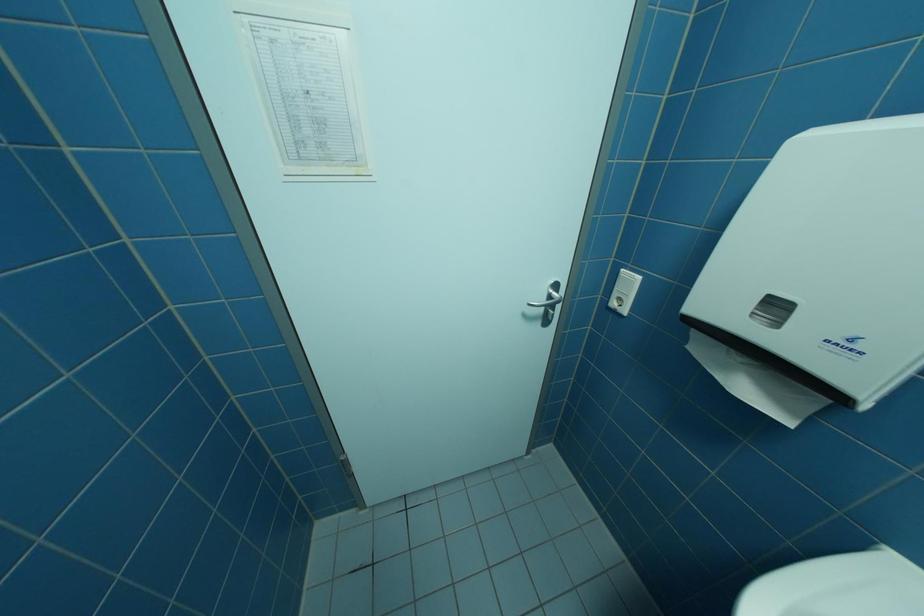
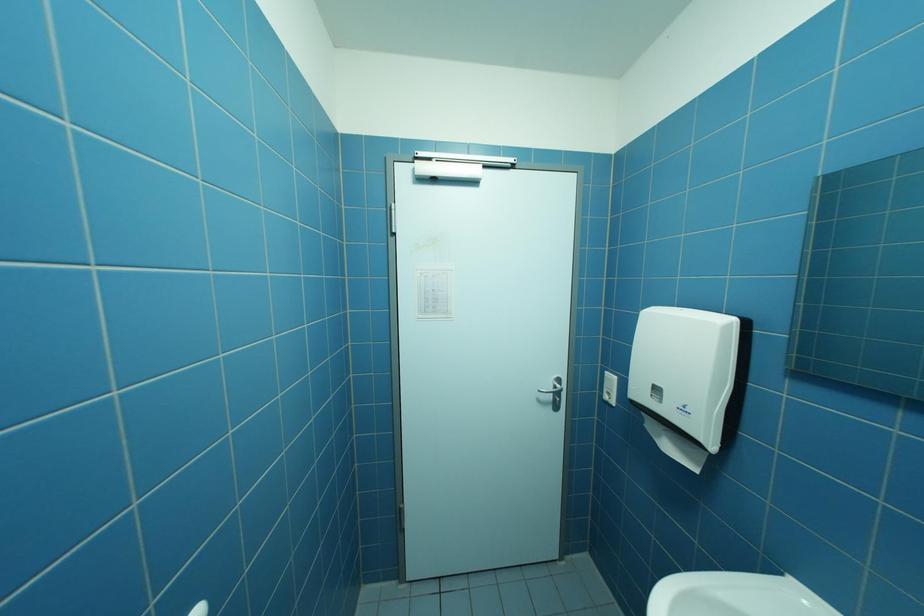
Question: What movement of the cameraman would produce the second image?

Choices:
 (A) Left
 (B) Right
 (C) Forward
 (D) Backward

Answer: (D)